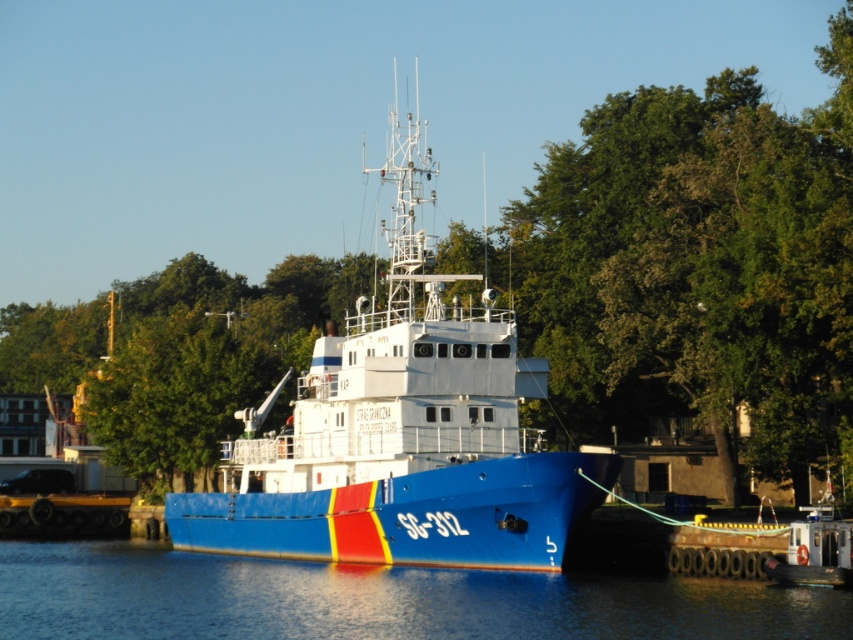
Question: Can you confirm if blue matte boat at center is wider than blue glossy water at lower center?

Choices:
 (A) yes
 (B) no

Answer: (B)

Question: Which point is closer to the camera taking this photo?

Choices:
 (A) (183, 522)
 (B) (152, 627)

Answer: (B)

Question: Is blue matte boat at center positioned in front of blue glossy water at lower center?

Choices:
 (A) no
 (B) yes

Answer: (A)

Question: Among these objects, which one is farthest from the camera?

Choices:
 (A) blue matte boat at center
 (B) blue glossy water at lower center

Answer: (A)

Question: Can you confirm if blue matte boat at center is positioned below blue glossy water at lower center?

Choices:
 (A) no
 (B) yes

Answer: (A)